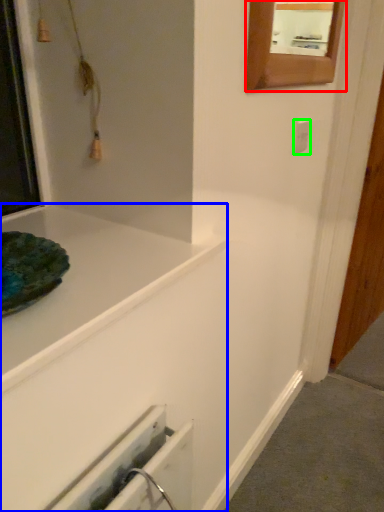
Question: Based on their relative distances, which object is nearer to mirror (highlighted by a red box)? Choose from bathtub (highlighted by a blue box) and electric outlet (highlighted by a green box).

Choices:
 (A) bathtub
 (B) electric outlet

Answer: (B)